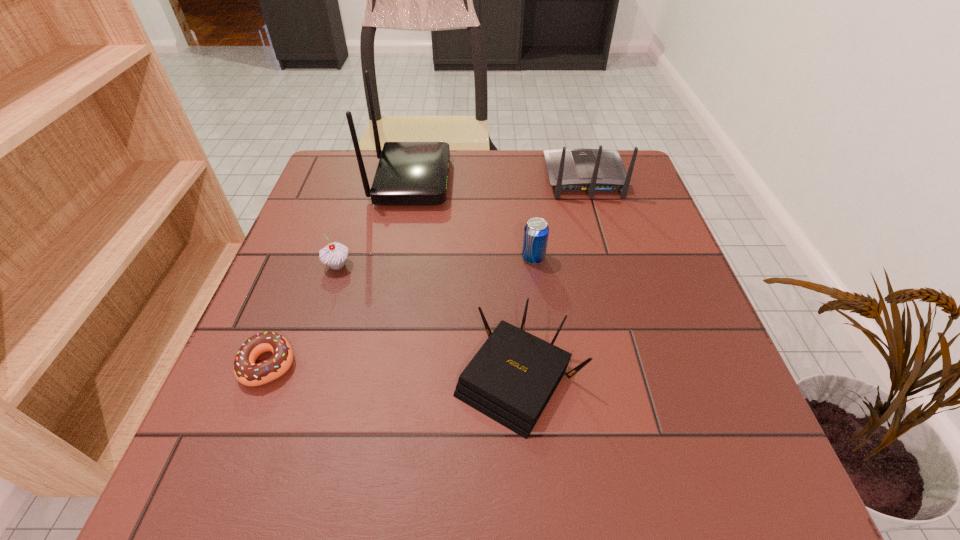
The image size is (960, 540). Identify the location of vacant space at the far edge. (503, 159).

In the image, there is a desktop. In order to click on vacant space at the near edge in this screenshot , I will do `click(593, 487)`.

In the image, there is a desktop. Identify the location of free space at the left edge. (291, 389).

In the image, there is a desktop. Where is `vacant space at the far left corner`? This screenshot has width=960, height=540. vacant space at the far left corner is located at coordinates (327, 164).

Locate an element on the screen. The height and width of the screenshot is (540, 960). vacant space in between the beer can and the leftmost router is located at coordinates point(472,219).

Find the location of a particular element. This screenshot has width=960, height=540. free spot between the tallest router and the beer can is located at coordinates (472, 219).

You are a GUI agent. You are given a task and a screenshot of the screen. Output one action in this format:
    pyautogui.click(x=<x>, y=<y>)
    Task: Click on the vacant area that lies between the tallest object and the cupcake
    
    Given the screenshot: What is the action you would take?
    pyautogui.click(x=374, y=223)

Locate an element on the screen. empty space that is in between the second router from left to right and the tallest object is located at coordinates (465, 280).

Where is `empty location between the cupcake and the beer can`? empty location between the cupcake and the beer can is located at coordinates (436, 262).

This screenshot has height=540, width=960. Find the location of `empty space that is in between the rightmost object and the doughnut`. empty space that is in between the rightmost object and the doughnut is located at coordinates (426, 271).